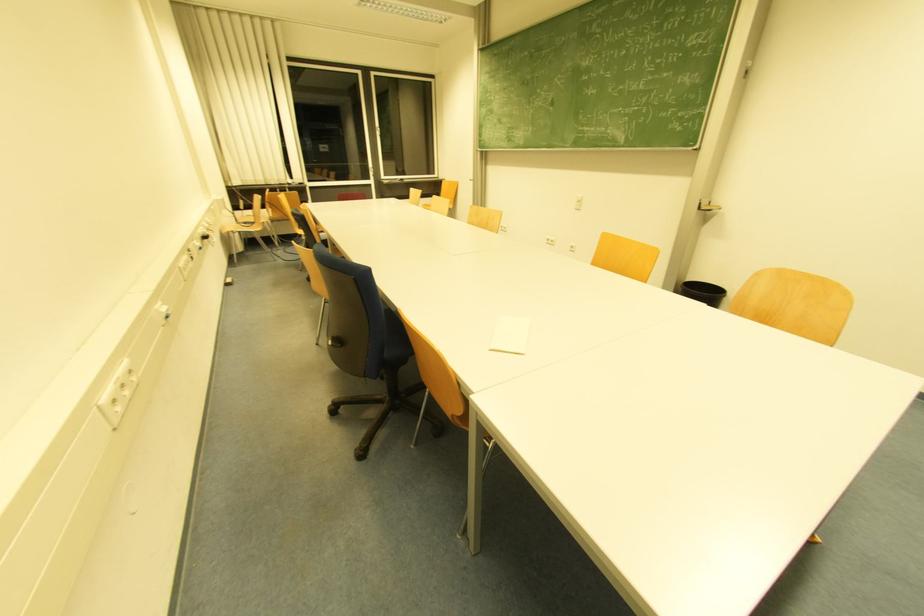
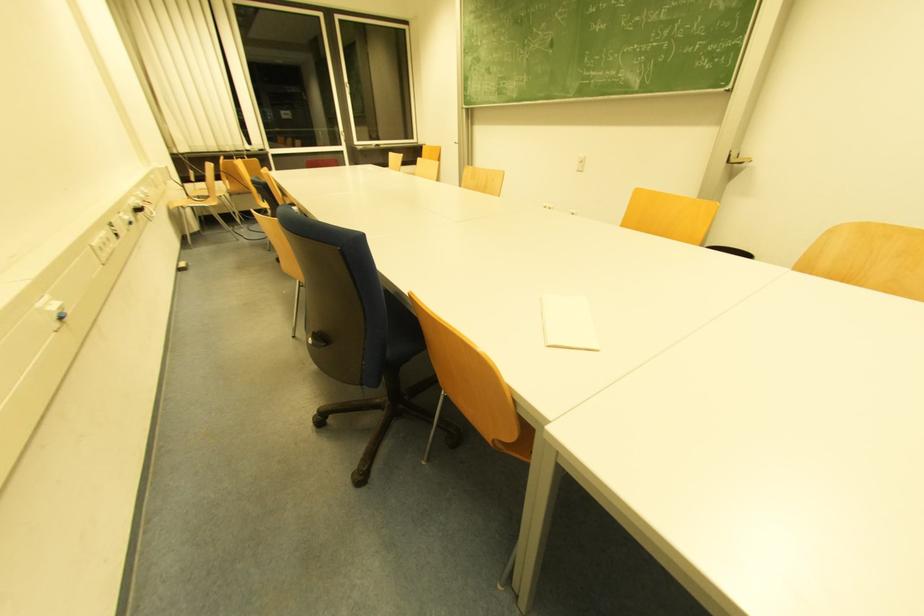
What movement of the cameraman would produce the second image?

The movement direction of the cameraman is left, forward.